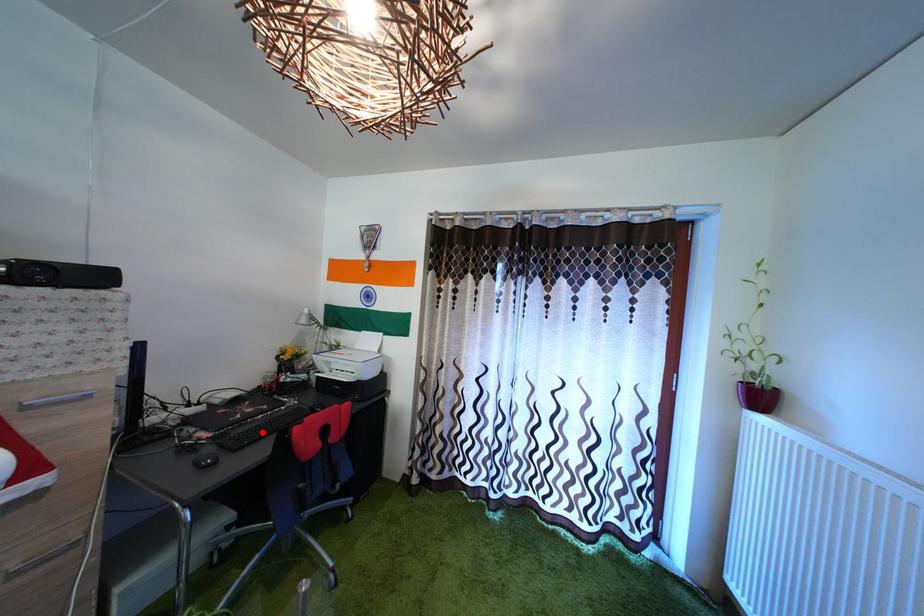
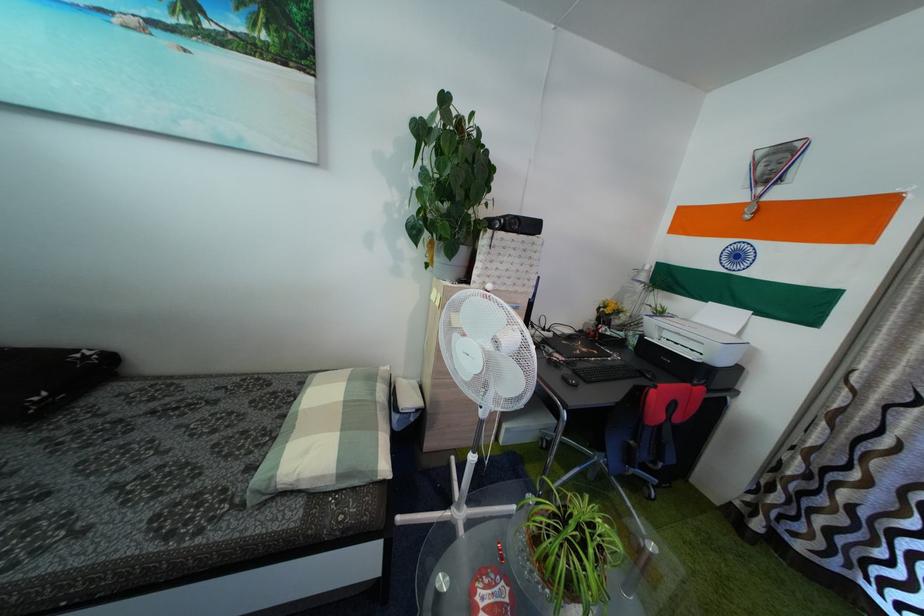
Where in the second image is the point corresponding to the highlighted location from the first image?

(599, 371)